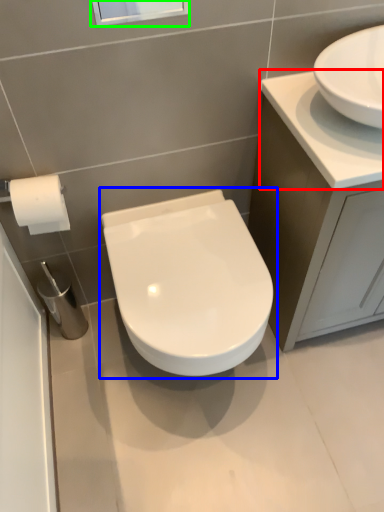
Question: Which object is the farthest from counter top (highlighted by a red box)? Choose among these: toilet (highlighted by a blue box) or window screen (highlighted by a green box).

Choices:
 (A) toilet
 (B) window screen

Answer: (B)